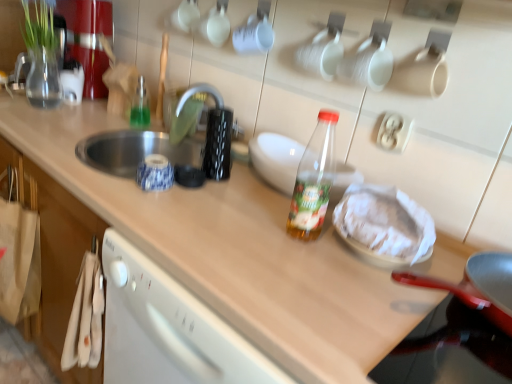
Question: Can you confirm if transparent plastic bottle at center, arranged as the second bottle when viewed from the left, is thinner than white paper wrapped food at center?

Choices:
 (A) yes
 (B) no

Answer: (A)

Question: From a real-world perspective, does transparent plastic bottle at center, the 1th bottle ordered from the bottom, stand above white paper wrapped food at center?

Choices:
 (A) no
 (B) yes

Answer: (B)

Question: Does transparent plastic bottle at center, the 1th bottle ordered from the bottom, appear on the right side of white paper wrapped food at center?

Choices:
 (A) no
 (B) yes

Answer: (A)

Question: Is transparent plastic bottle at center, acting as the 2th bottle starting from the back, outside of white paper wrapped food at center?

Choices:
 (A) no
 (B) yes

Answer: (B)

Question: Is transparent plastic bottle at center, the 1th bottle ordered from the bottom, positioned behind white paper wrapped food at center?

Choices:
 (A) yes
 (B) no

Answer: (A)

Question: Which is correct: white paper wrapped food at center is inside transparent plastic bottle at center, or outside of it?

Choices:
 (A) outside
 (B) inside

Answer: (A)

Question: From the image's perspective, relative to transparent plastic bottle at center, is white paper wrapped food at center above or below?

Choices:
 (A) above
 (B) below

Answer: (B)

Question: Looking at the image, does white paper wrapped food at center seem bigger or smaller compared to transparent plastic bottle at center?

Choices:
 (A) small
 (B) big

Answer: (A)

Question: From a real-world perspective, relative to transparent plastic bottle at center, is white paper wrapped food at center vertically above or below?

Choices:
 (A) above
 (B) below

Answer: (A)

Question: From the image's perspective, is silver metallic faucet at upper center positioned above or below transparent plastic bottle at center, arranged as the 1th bottle when viewed from the front?

Choices:
 (A) above
 (B) below

Answer: (A)

Question: Would you say silver metallic faucet at upper center is inside or outside transparent plastic bottle at center, arranged as the second bottle when viewed from the left?

Choices:
 (A) inside
 (B) outside

Answer: (B)

Question: Considering the positions of silver metallic faucet at upper center and transparent plastic bottle at center, arranged as the 1th bottle when viewed from the front, in the image, is silver metallic faucet at upper center wider or thinner than transparent plastic bottle at center, arranged as the 1th bottle when viewed from the front,?

Choices:
 (A) wide
 (B) thin

Answer: (A)

Question: Is silver metallic faucet at upper center in front of or behind transparent plastic bottle at center, the 1th bottle ordered from the bottom, in the image?

Choices:
 (A) behind
 (B) front

Answer: (A)

Question: From a real-world perspective, is transparent plastic bottle at center, the 1th bottle ordered from the bottom, positioned above or below transparent glass bottle at upper center, which appears as the first bottle when viewed from the back?

Choices:
 (A) below
 (B) above

Answer: (B)

Question: In terms of width, does transparent plastic bottle at center, arranged as the 1th bottle when viewed from the front, look wider or thinner when compared to transparent glass bottle at upper center, which is the first bottle in top-to-bottom order?

Choices:
 (A) wide
 (B) thin

Answer: (A)